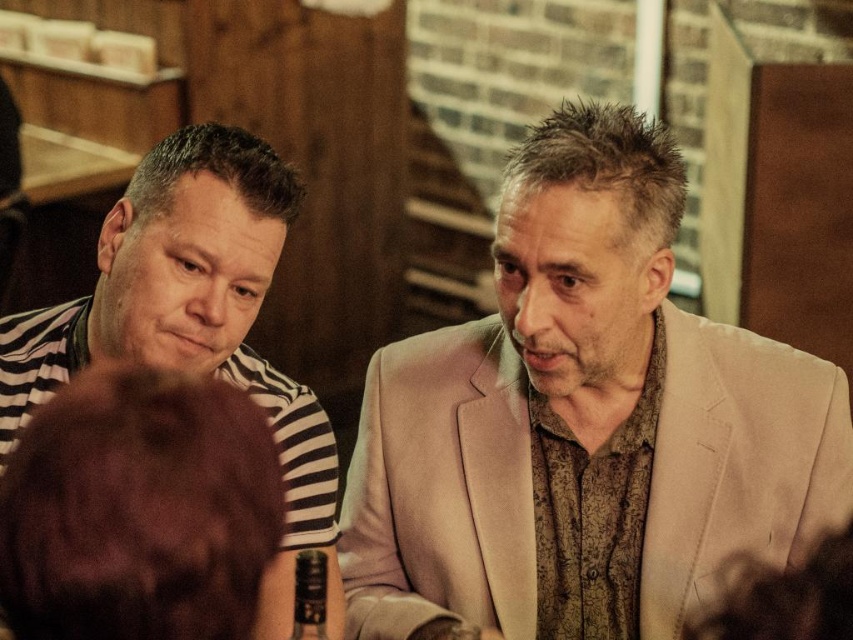
Is point (579, 205) farther from viewer compared to point (65, 497)?

Yes, it is.

Looking at this image, is light beige suit at center taller than dark brown fur at lower left?

Correct, light beige suit at center is much taller as dark brown fur at lower left.

Between point (426, 593) and point (6, 522), which one is positioned in front?

Point (6, 522)

Image resolution: width=853 pixels, height=640 pixels. Find the location of `light beige suit at center`. light beige suit at center is located at coordinates (583, 422).

Is light beige suit at center to the right of striped fabric shirt at left from the viewer's perspective?

Yes, light beige suit at center is to the right of striped fabric shirt at left.

Does light beige suit at center have a greater height compared to striped fabric shirt at left?

Yes.

Find the location of a particular element. Image resolution: width=853 pixels, height=640 pixels. light beige suit at center is located at coordinates (583, 422).

Can you confirm if dark brown fur at lower left is wider than striped fabric shirt at left?

No.

Describe the element at coordinates (138, 509) in the screenshot. Image resolution: width=853 pixels, height=640 pixels. I see `dark brown fur at lower left` at that location.

Locate an element on the screen. The width and height of the screenshot is (853, 640). dark brown fur at lower left is located at coordinates (138, 509).